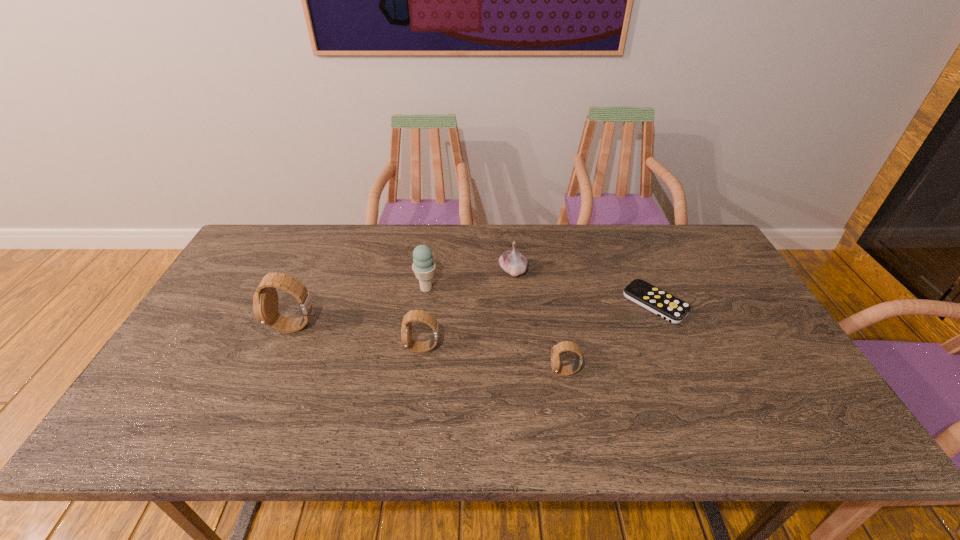
Where is `free space at the far right corner of the desktop`? The width and height of the screenshot is (960, 540). free space at the far right corner of the desktop is located at coordinates (685, 234).

At what (x,y) coordinates should I click in order to perform the action: click on vacant area between the ice cream and the rightmost object. Please return your answer as a coordinate pair (x, y). The height and width of the screenshot is (540, 960). Looking at the image, I should click on (540, 296).

Locate an element on the screen. The height and width of the screenshot is (540, 960). vacant space that is in between the shortest object and the leftmost watch is located at coordinates (475, 315).

At what (x,y) coordinates should I click in order to perform the action: click on vacant area that lies between the ice cream and the remote control. Please return your answer as a coordinate pair (x, y). Looking at the image, I should click on (540, 296).

Identify the location of free space between the ice cream and the farthest object. point(469,280).

Where is `free space between the fourth object from left to right and the leftmost object`? free space between the fourth object from left to right and the leftmost object is located at coordinates (404, 299).

Locate an element on the screen. The width and height of the screenshot is (960, 540). empty space between the shortest watch and the second watch from left to right is located at coordinates (493, 360).

The width and height of the screenshot is (960, 540). I want to click on free spot between the fourth object from left to right and the remote control, so [584, 287].

At what (x,y) coordinates should I click in order to perform the action: click on blank region between the remote control and the tallest watch. Please return your answer as a coordinate pair (x, y). This screenshot has width=960, height=540. Looking at the image, I should click on (475, 315).

You are a GUI agent. You are given a task and a screenshot of the screen. Output one action in this format:
    pyautogui.click(x=<x>, y=<y>)
    Task: Click on the free space between the nearest object and the ice cream
    This screenshot has height=540, width=960.
    Given the screenshot: What is the action you would take?
    pyautogui.click(x=495, y=330)